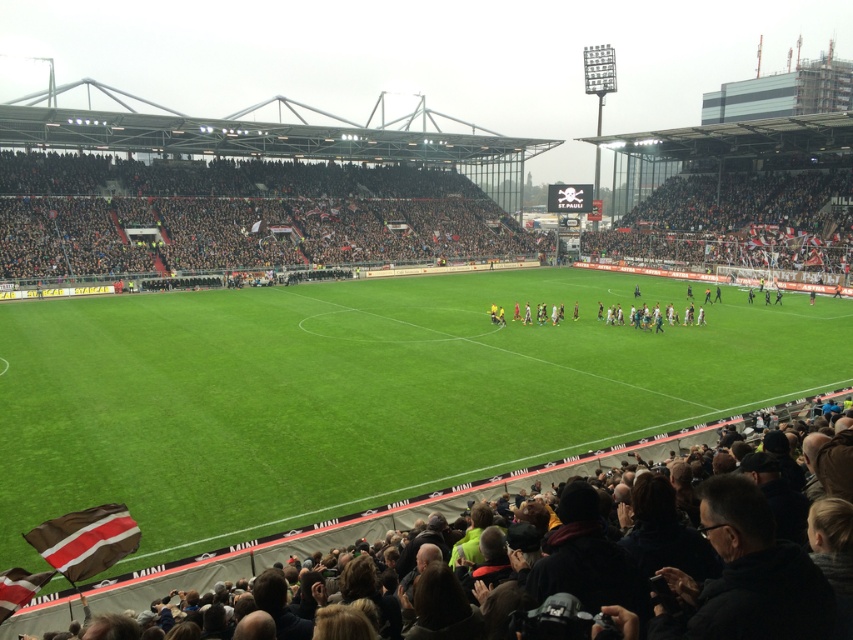
Is dark gray fabric crowd at lower center smaller than striped fabric flag at lower left?

Actually, dark gray fabric crowd at lower center might be larger than striped fabric flag at lower left.

The image size is (853, 640). What do you see at coordinates (351, 528) in the screenshot?
I see `dark gray fabric crowd at lower center` at bounding box center [351, 528].

Is point (646, 451) positioned in front of point (4, 616)?

No.

The height and width of the screenshot is (640, 853). I want to click on dark gray fabric crowd at lower center, so click(351, 528).

Is point (360, 538) positioned in front of point (51, 560)?

No, it is behind (51, 560).

How far apart are dark gray fabric crowd at lower center and brown striped fabric at lower left?

A distance of 3.13 meters exists between dark gray fabric crowd at lower center and brown striped fabric at lower left.

Does point (198, 573) lie behind point (67, 548)?

Yes, it is behind point (67, 548).

Where is `dark gray fabric crowd at lower center`? The height and width of the screenshot is (640, 853). dark gray fabric crowd at lower center is located at coordinates (351, 528).

Which is more to the left, brown striped fabric at lower left or striped fabric flag at lower left?

striped fabric flag at lower left

Is brown striped fabric at lower left bigger than striped fabric flag at lower left?

Correct, brown striped fabric at lower left is larger in size than striped fabric flag at lower left.

Which is in front, point (94, 556) or point (13, 566)?

Positioned in front is point (13, 566).

The width and height of the screenshot is (853, 640). Identify the location of brown striped fabric at lower left. (85, 540).